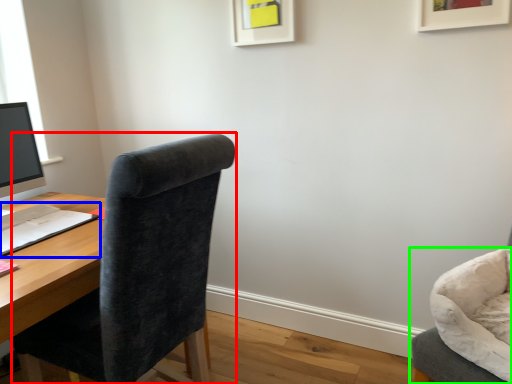
Question: Considering the real-world distances, which object is closest to chair (highlighted by a red box)? notepad (highlighted by a blue box) or chair (highlighted by a green box).

Choices:
 (A) notepad
 (B) chair

Answer: (A)